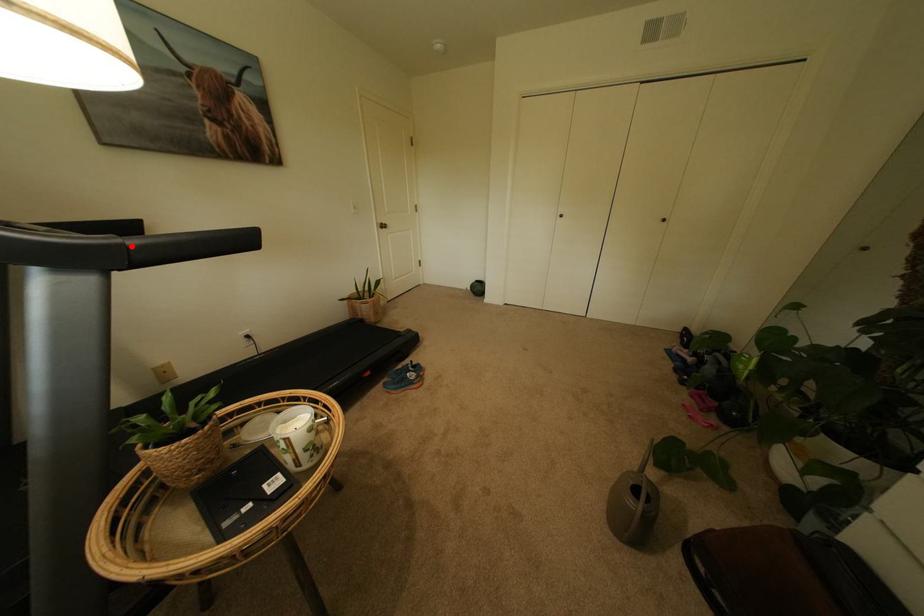
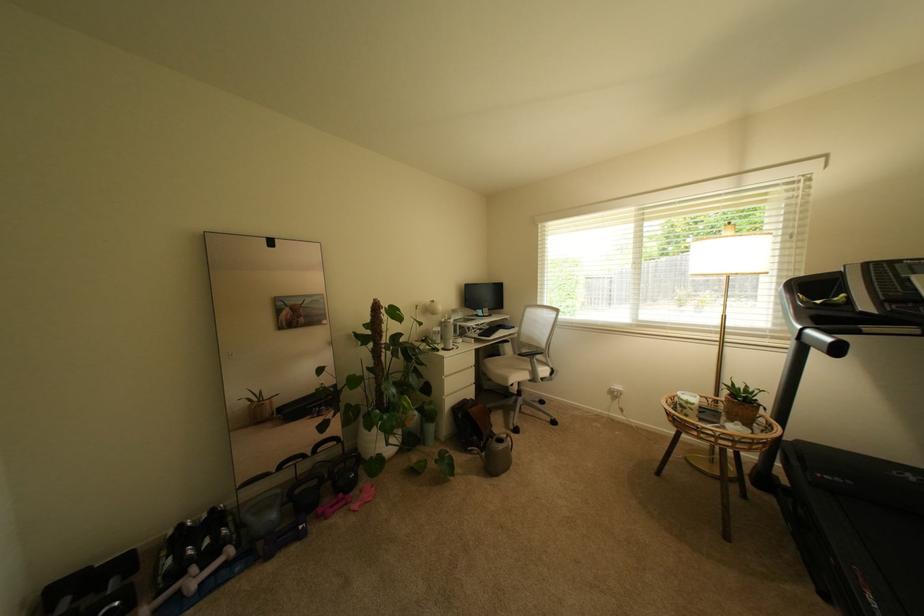
The point at the highlighted location is marked in the first image. Where is the corresponding point in the second image?

(807, 331)